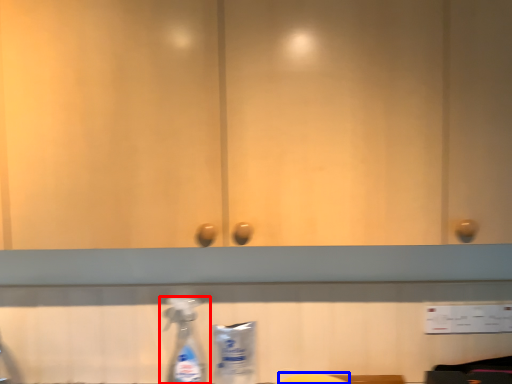
Question: Among these objects, which one is farthest to the camera, bottle (highlighted by a red box) or wide (highlighted by a blue box)?

Choices:
 (A) bottle
 (B) wide

Answer: (A)